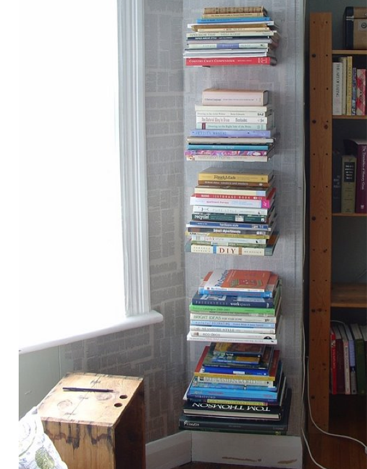
This screenshot has width=367, height=469. Find the location of `stack of books top shelf`. stack of books top shelf is located at coordinates (223, 32).